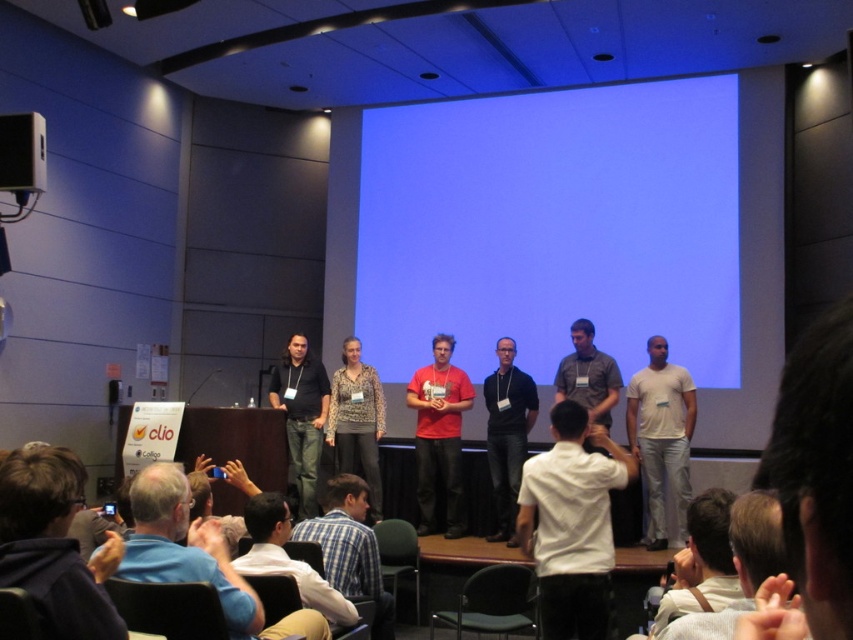
You are an attendee at this conference standing in the front row. You notice the blue plaid shirt at lower center and the matte black shirt at center. Which person is physically closer to you?

The blue plaid shirt at lower center is closer to the viewer than the matte black shirt at center, so the person wearing the blue plaid shirt at lower center is physically closer to you.